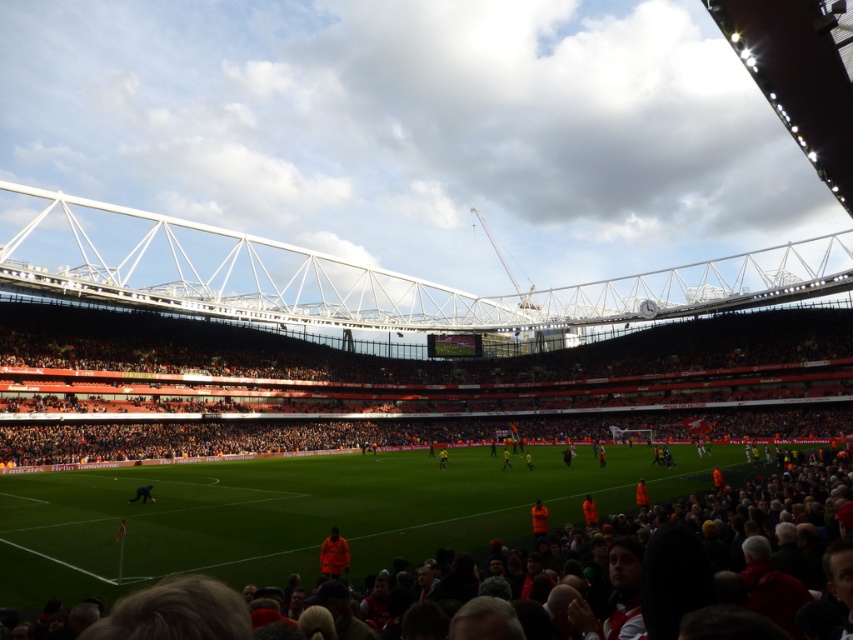
You are a photographer trying to capture a wide shot of the football field. You notice an orange fabric jacket at lower center and a yellow uniform at center. Which of these two items would appear smaller in your photo?

The orange fabric jacket at lower center appears smaller in the photo because it has a smaller size compared to the yellow uniform at center.

In the scene shown: You are a photographer at the edge of the field. You want to take a photo that includes both the orange fabric person at center and the yellow uniform at center. Which of the two will appear larger in your photo?

The yellow uniform at center will appear larger in the photo than the orange fabric person at center because the orange fabric person at center is smaller than yellow uniform at center.

You are a drone operator tasked with capturing aerial footage of the football match. Your drone is currently hovering above the orange fabric person at center. To ensure safety, you need to move the drone to a position that is at least 2 meters away from this person. Given the coordinates provided, can you determine if the current position is safe?

The orange fabric person at center is located at point coordinates. Since the drone is hovering above them, it is not yet at a safe distance of 2 meters. You need to move the drone further away to comply with safety requirements.